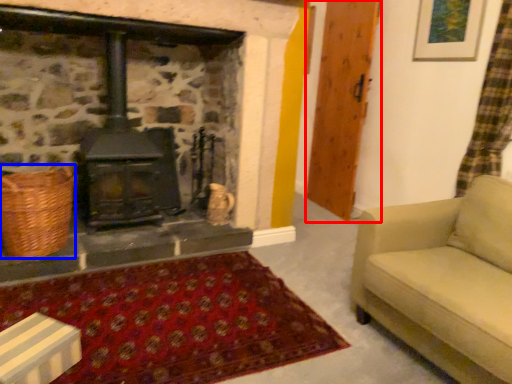
Question: Which of the following is the farthest to the observer, wood (highlighted by a red box) or basket (highlighted by a blue box)?

Choices:
 (A) wood
 (B) basket

Answer: (A)